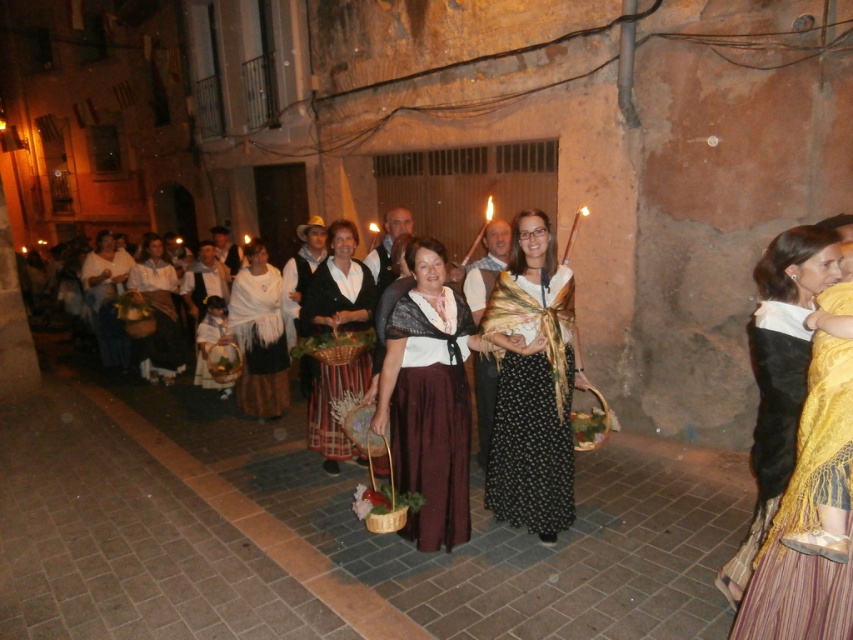
Question: Does gold woven shawl at center have a larger size compared to matte white blouse at center?

Choices:
 (A) no
 (B) yes

Answer: (A)

Question: Is black textured dress at center below matte brown skirt at center?

Choices:
 (A) no
 (B) yes

Answer: (A)

Question: Based on their relative distances, which object is farther from the white cotton dress at center?

Choices:
 (A) striped cotton skirt at center
 (B) black textured dress at center

Answer: (B)

Question: Is gold woven shawl at center above striped cotton skirt at center?

Choices:
 (A) yes
 (B) no

Answer: (B)

Question: Which point is closer to the camera?

Choices:
 (A) (268, 413)
 (B) (97, 266)
 (C) (151, 243)

Answer: (A)

Question: Which point is farther from the camera taking this photo?

Choices:
 (A) (502, 419)
 (B) (245, 244)
 (C) (788, 593)

Answer: (B)